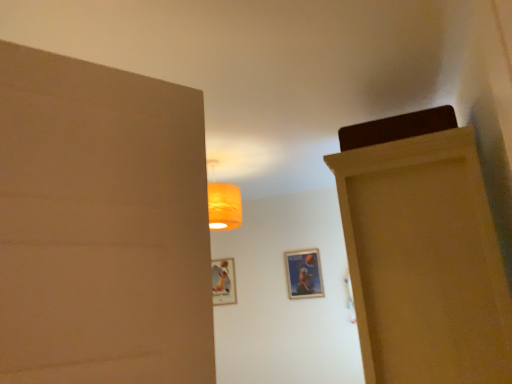
Question: Can we say matte plastic picture frame at center, which is the 1th picture frame from left to right, lies outside wooden door at right?

Choices:
 (A) yes
 (B) no

Answer: (A)

Question: Is matte plastic picture frame at center, which is the 1th picture frame from left to right, facing towards wooden door at right?

Choices:
 (A) yes
 (B) no

Answer: (B)

Question: From a real-world perspective, is matte plastic picture frame at center, which is the 1th picture frame from left to right, on top of wooden door at right?

Choices:
 (A) no
 (B) yes

Answer: (B)

Question: From the image's perspective, would you say matte plastic picture frame at center, arranged as the 1th picture frame when viewed from the back, is positioned over wooden door at right?

Choices:
 (A) yes
 (B) no

Answer: (B)

Question: From a real-world perspective, does matte plastic picture frame at center, which is the 1th picture frame from left to right, sit lower than wooden door at right?

Choices:
 (A) no
 (B) yes

Answer: (A)

Question: Is matte plastic picture frame at center, the second picture frame positioned from the right, in contact with wooden door at right?

Choices:
 (A) yes
 (B) no

Answer: (B)

Question: Is metallic silver picture frame at center, which ranks as the first picture frame in front-to-back order, looking in the opposite direction of matte plastic picture frame at center, the second picture frame positioned from the right?

Choices:
 (A) yes
 (B) no

Answer: (B)

Question: Does metallic silver picture frame at center, which is the second picture frame in back-to-front order, have a greater height compared to matte plastic picture frame at center, which is the second picture frame in front-to-back order?

Choices:
 (A) no
 (B) yes

Answer: (A)

Question: From the image's perspective, is metallic silver picture frame at center, which ranks as the first picture frame in front-to-back order, on matte plastic picture frame at center, which is the second picture frame in front-to-back order?

Choices:
 (A) no
 (B) yes

Answer: (B)

Question: From the image's perspective, is metallic silver picture frame at center, which is the second picture frame in back-to-front order, below matte plastic picture frame at center, the second picture frame positioned from the right?

Choices:
 (A) yes
 (B) no

Answer: (B)

Question: Can you confirm if metallic silver picture frame at center, arranged as the first picture frame when viewed from the right, is smaller than matte plastic picture frame at center, arranged as the 1th picture frame when viewed from the back?

Choices:
 (A) yes
 (B) no

Answer: (A)

Question: From a real-world perspective, is metallic silver picture frame at center, which ranks as the first picture frame in front-to-back order, on matte plastic picture frame at center, arranged as the 1th picture frame when viewed from the back?

Choices:
 (A) no
 (B) yes

Answer: (A)

Question: Is wooden door at right oriented away from matte plastic picture frame at center, which is the 1th picture frame from left to right?

Choices:
 (A) no
 (B) yes

Answer: (A)